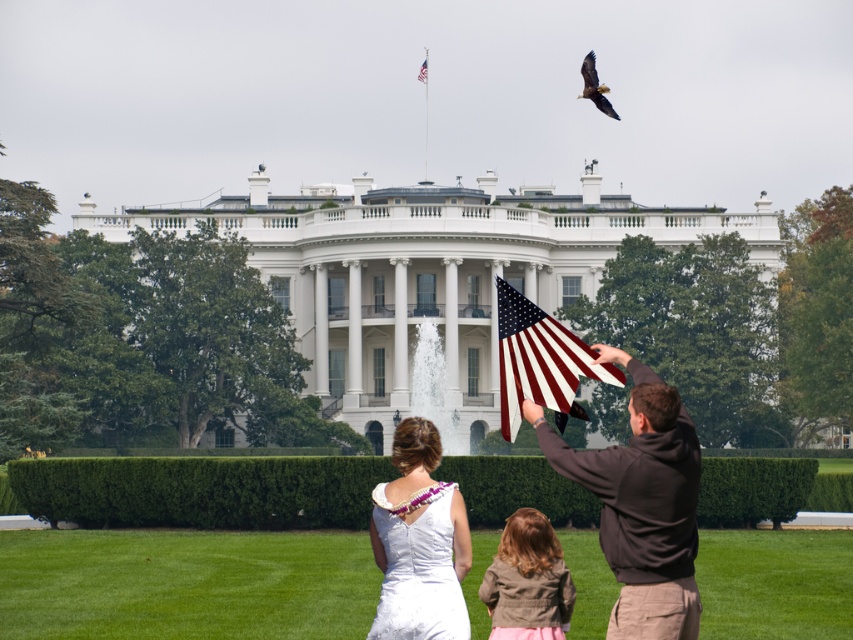
Question: Considering the relative positions of white satin dress at center and brown textured jacket at lower center in the image provided, where is white satin dress at center located with respect to brown textured jacket at lower center?

Choices:
 (A) right
 (B) left

Answer: (B)

Question: Is matte brown hoodie at center positioned in front of brown textured jacket at lower center?

Choices:
 (A) no
 (B) yes

Answer: (B)

Question: Does brown textured jacket at lower center have a smaller size compared to american flag at center?

Choices:
 (A) yes
 (B) no

Answer: (B)

Question: Which object is closer to the camera taking this photo?

Choices:
 (A) green grass at lower center
 (B) american flag at center
 (C) matte brown hoodie at center

Answer: (C)

Question: Which of the following is the closest to the observer?

Choices:
 (A) brown feathered eagle at upper right
 (B) red-white striped flag at center

Answer: (B)

Question: Which object appears farthest from the camera in this image?

Choices:
 (A) matte brown hoodie at center
 (B) red-white striped flag at center

Answer: (B)